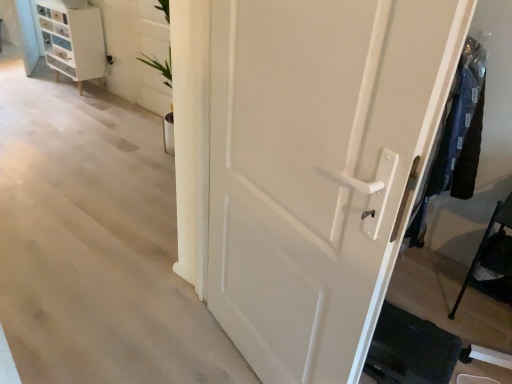
Where is `vacant area in front of white glossy chest of drawers at upper left`? This screenshot has width=512, height=384. vacant area in front of white glossy chest of drawers at upper left is located at coordinates (55, 97).